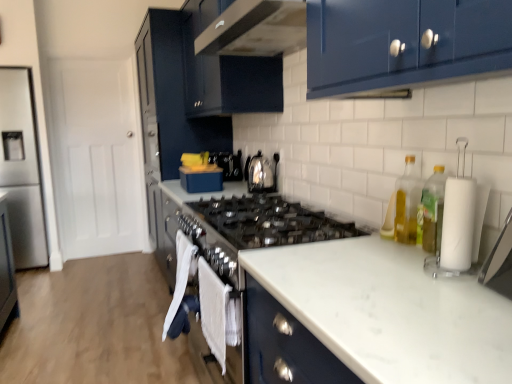
Where is `free space to the left of clear glass bottle at right, the first bottle from the back`? The width and height of the screenshot is (512, 384). free space to the left of clear glass bottle at right, the first bottle from the back is located at coordinates (367, 245).